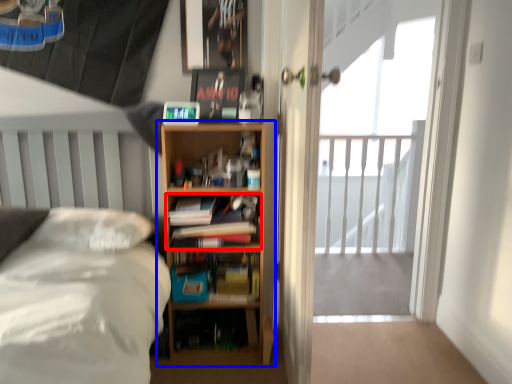
Question: Which object appears closest to the camera in this image, book (highlighted by a red box) or bookcase (highlighted by a blue box)?

Choices:
 (A) book
 (B) bookcase

Answer: (B)